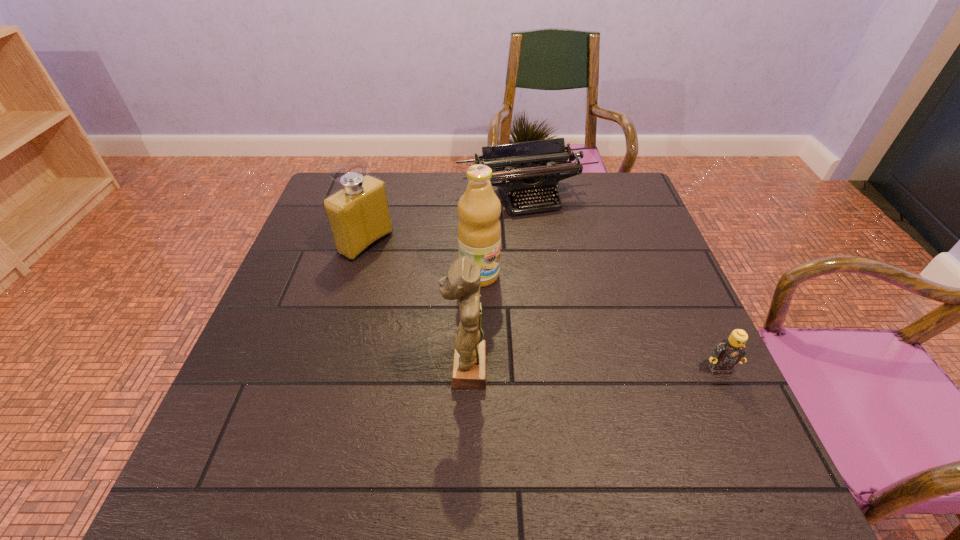
Where is `free spot on the desktop that is between the figurine and the shortest object and is positioned on the typing side of the farthest object`? free spot on the desktop that is between the figurine and the shortest object and is positioned on the typing side of the farthest object is located at coordinates (611, 369).

Identify the location of vacant space on the desktop that is between the figurine and the shortest object and is positioned on the front-facing side of the perfume. (603, 369).

Locate an element on the screen. The image size is (960, 540). free space on the desktop that is between the figurine and the shortest object and is positioned on the label of the olive oil is located at coordinates (608, 369).